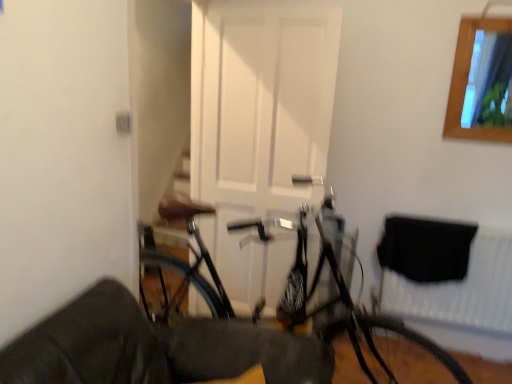
In order to face white matte door at center, should I rotate leftwards or rightwards?

Turn right by 1.164 degrees to look at white matte door at center.

What do you see at coordinates (447, 272) in the screenshot? Image resolution: width=512 pixels, height=384 pixels. I see `black fabric at lower right` at bounding box center [447, 272].

Identify the location of black fabric at lower right. The height and width of the screenshot is (384, 512). (447, 272).

At what (x,y) coordinates should I click in order to perform the action: click on shiny black tire at lower right. Please return your answer as a coordinate pair (x, y). Looking at the image, I should click on (390, 354).

Between shiny black tire at lower right and shiny metallic bicycle at center, which one appears on the left side from the viewer's perspective?

From the viewer's perspective, shiny metallic bicycle at center appears more on the left side.

From the image's perspective, is shiny black tire at lower right on top of shiny metallic bicycle at center?

No, from the image's perspective, shiny black tire at lower right is not on top of shiny metallic bicycle at center.

The height and width of the screenshot is (384, 512). What are the coordinates of `bicycle wheel that is on the right side of shiny metallic bicycle at center` in the screenshot? It's located at (390, 354).

How different are the orientations of shiny black tire at lower right and shiny metallic bicycle at center in degrees?

The angular difference between shiny black tire at lower right and shiny metallic bicycle at center is 6.97 degrees.

From the picture: Is white matte door at center oriented away from black fabric at lower right?

No, white matte door at center is not facing the opposite direction of black fabric at lower right.

From a real-world perspective, is white matte door at center located higher than black fabric at lower right?

Yes, from a real-world perspective, white matte door at center is over black fabric at lower right

From the image's perspective, is white matte door at center located beneath black fabric at lower right?

No, from the image's perspective, white matte door at center is not beneath black fabric at lower right.

How distant is black fabric at lower right from white matte door at center?

black fabric at lower right and white matte door at center are 35.89 inches apart from each other.

In terms of height, does black fabric at lower right look taller or shorter compared to white matte door at center?

black fabric at lower right is shorter than white matte door at center.

In the image, is black fabric at lower right on the left side or the right side of white matte door at center?

black fabric at lower right is positioned on white matte door at center's right side.

From a real-world perspective, who is located higher, black fabric at lower right or white matte door at center?

From a 3D spatial view, white matte door at center is above.

From the image's perspective, is black fabric at lower right located beneath shiny metallic bicycle at center?

Indeed, from the image's perspective, black fabric at lower right is shown beneath shiny metallic bicycle at center.

From a real-world perspective, is black fabric at lower right beneath shiny metallic bicycle at center?

Correct, in the physical world, black fabric at lower right is lower than shiny metallic bicycle at center.

Does black fabric at lower right have a lesser height compared to shiny metallic bicycle at center?

Yes.

Which point is more forward, (x=450, y=236) or (x=390, y=375)?

The point (x=390, y=375) is in front.

Looking at this image, who is smaller, shiny metallic bicycle at center or white matte door at center?

Smaller between the two is white matte door at center.

Who is shorter, shiny metallic bicycle at center or white matte door at center?

shiny metallic bicycle at center is shorter.

From the picture: From the image's perspective, is shiny metallic bicycle at center on white matte door at center?

No, from the image's perspective, shiny metallic bicycle at center is not over white matte door at center.

Does shiny metallic bicycle at center touch white matte door at center?

No, shiny metallic bicycle at center is not touching white matte door at center.

Which is more distant, [459,135] or [342,359]?

Point [342,359]

Does wooden frame at upper right come behind shiny black tire at lower right?

Yes, it is.

Is wooden frame at upper right facing towards shiny black tire at lower right?

No, wooden frame at upper right is not turned towards shiny black tire at lower right.

Considering their positions, is shiny metallic bicycle at center located in front of or behind shiny black tire at lower right?

shiny metallic bicycle at center is in front of shiny black tire at lower right.

Would you consider shiny metallic bicycle at center to be distant from shiny black tire at lower right?

No, shiny metallic bicycle at center is not far from shiny black tire at lower right.

Is shiny metallic bicycle at center at the left side of shiny black tire at lower right?

Indeed, shiny metallic bicycle at center is positioned on the left side of shiny black tire at lower right.

From a real-world perspective, is shiny metallic bicycle at center physically below shiny black tire at lower right?

No, from a real-world perspective, shiny metallic bicycle at center is not under shiny black tire at lower right.

Locate an element on the screen. The image size is (512, 384). bicycle to the left of shiny black tire at lower right is located at coordinates (319, 317).

I want to click on door in front of the black fabric at lower right, so click(x=259, y=130).

From the image, which object appears to be farther from shiny metallic bicycle at center, shiny black tire at lower right or black fabric at lower right?

black fabric at lower right.

Estimate the real-world distances between objects in this image. Which object is closer to shiny metallic bicycle at center, wooden frame at upper right or black fabric at lower right?

black fabric at lower right.

Which object lies further to the anchor point black fabric at lower right, shiny metallic bicycle at center or wooden frame at upper right?

Based on the image, wooden frame at upper right appears to be further to black fabric at lower right.

From the image, which object appears to be nearer to shiny metallic bicycle at center, black fabric at lower right or shiny black tire at lower right?

shiny black tire at lower right is closer to shiny metallic bicycle at center.

Which object lies nearer to the anchor point shiny metallic bicycle at center, white matte door at center or wooden frame at upper right?

→ white matte door at center.

When comparing their distances from shiny black tire at lower right, does shiny metallic bicycle at center or wooden frame at upper right seem further?

wooden frame at upper right is positioned further to the anchor shiny black tire at lower right.

When comparing their distances from wooden frame at upper right, does white matte door at center or shiny black tire at lower right seem further?

Among the two, shiny black tire at lower right is located further to wooden frame at upper right.

Based on their spatial positions, is black fabric at lower right or shiny metallic bicycle at center closer to wooden frame at upper right?

black fabric at lower right is closer to wooden frame at upper right.

You are a GUI agent. You are given a task and a screenshot of the screen. Output one action in this format:
    pyautogui.click(x=<x>, y=<y>)
    Task: Click on the bicycle wheel between white matte door at center and black fabric at lower right
    
    Given the screenshot: What is the action you would take?
    pyautogui.click(x=390, y=354)

I want to click on bicycle that lies between white matte door at center and shiny black tire at lower right from top to bottom, so click(319, 317).

I want to click on door between shiny metallic bicycle at center and black fabric at lower right from left to right, so click(259, 130).

This screenshot has height=384, width=512. What are the coordinates of `door between wooden frame at upper right and shiny black tire at lower right in the vertical direction` in the screenshot? It's located at (259, 130).